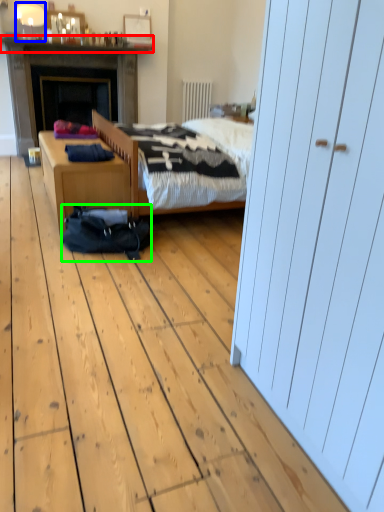
Question: Which object is the closest to the mantle (highlighted by a red box)? Choose among these: lamp (highlighted by a blue box) or sleeping bag (highlighted by a green box).

Choices:
 (A) lamp
 (B) sleeping bag

Answer: (A)